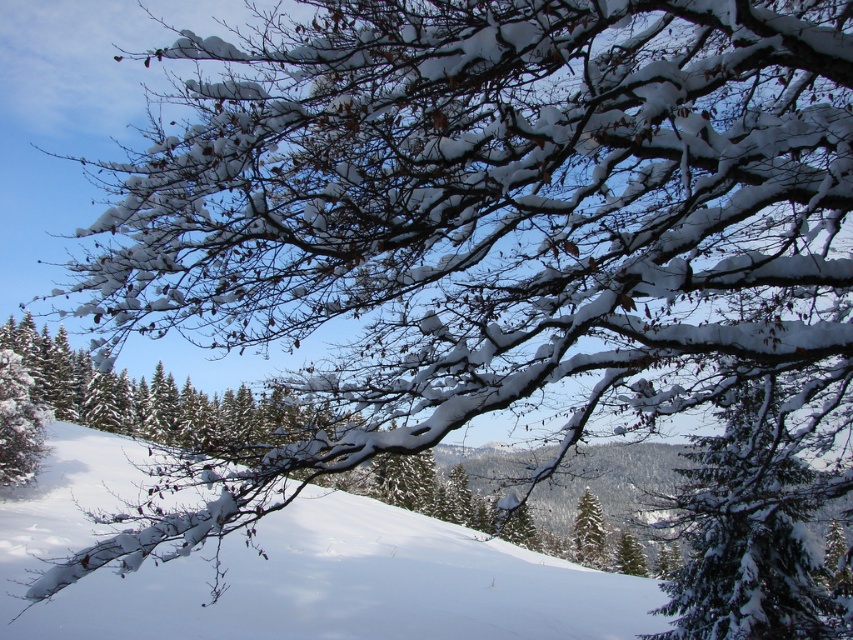
Question: Is white snow at center to the right of green matte tree at center from the viewer's perspective?

Choices:
 (A) yes
 (B) no

Answer: (B)

Question: Which of the following is the closest to the observer?

Choices:
 (A) white snow at center
 (B) green matte tree at center

Answer: (A)

Question: Where is snow-covered branch at upper right located in relation to green matte tree at center in the image?

Choices:
 (A) right
 (B) left

Answer: (B)

Question: Among these points, which one is farthest from the camera?

Choices:
 (A) (679, 515)
 (B) (113, 582)

Answer: (A)

Question: Is snow-covered branch at upper right below green matte tree at center?

Choices:
 (A) no
 (B) yes

Answer: (A)

Question: Which object is the closest to the white snow at center?

Choices:
 (A) green matte tree at center
 (B) snow-covered branch at upper right

Answer: (B)